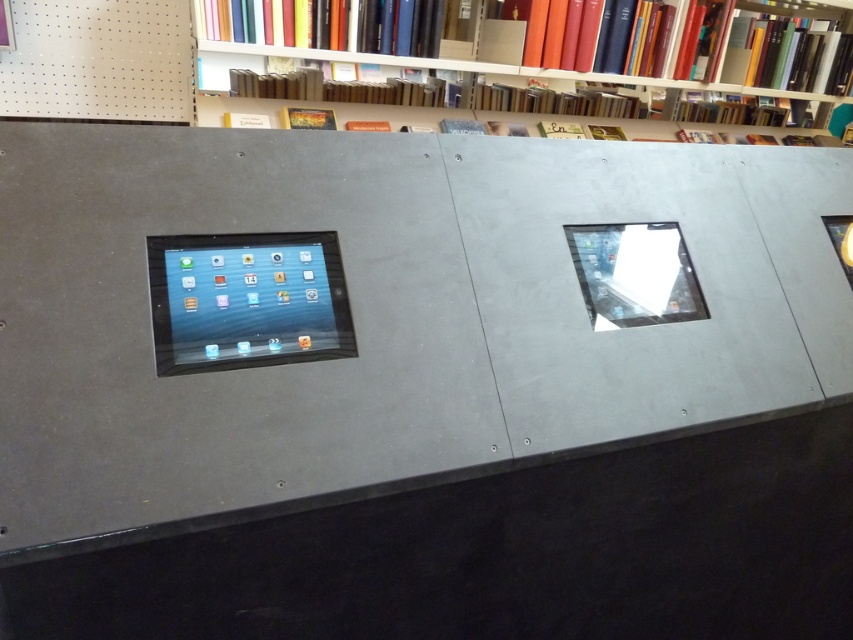
Between glossy plastic tablet at right and hardcover book at upper center, which one is positioned higher?

hardcover book at upper center is higher up.

This screenshot has width=853, height=640. I want to click on glossy plastic tablet at right, so click(634, 275).

Is matte black tablet at left bigger than matte yellow book at upper center?

Yes, matte black tablet at left is bigger than matte yellow book at upper center.

Is point (265, 266) farther from camera compared to point (544, 122)?

No, (265, 266) is closer to viewer.

Where is `matte black tablet at left`? matte black tablet at left is located at coordinates (247, 300).

Is matte gray bookcase at upper center below hardcover book at upper center?

No, matte gray bookcase at upper center is not below hardcover book at upper center.

Does matte gray bookcase at upper center have a lesser width compared to hardcover book at upper center?

Incorrect, matte gray bookcase at upper center's width is not less than hardcover book at upper center's.

Is point (544, 67) positioned after point (323, 109)?

Yes, it is.

This screenshot has width=853, height=640. Identify the location of matte gray bookcase at upper center. (538, 49).